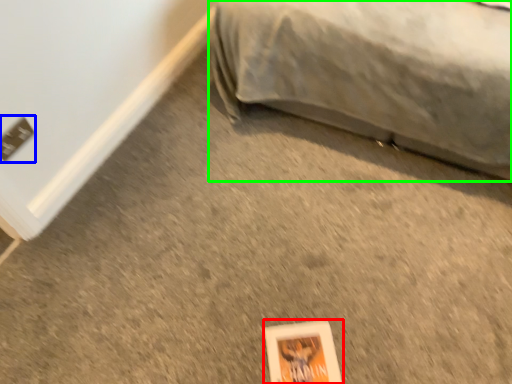
Question: Which object is positioned closest to paperback book (highlighted by a red box)? Select from electric outlet (highlighted by a blue box) and furniture (highlighted by a green box).

Choices:
 (A) electric outlet
 (B) furniture

Answer: (B)